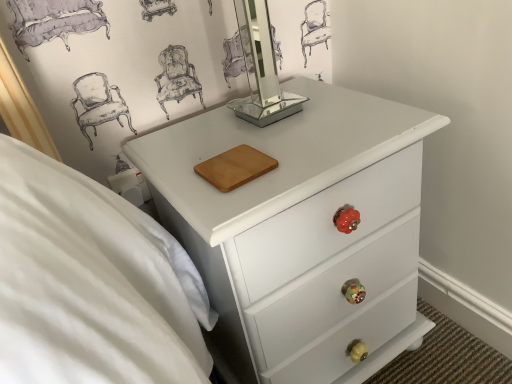
At what (x,y) coordinates should I click in order to perform the action: click on free point above white glossy chest of drawers at center (from a real-world perspective). Please return your answer as a coordinate pair (x, y). This screenshot has height=384, width=512. Looking at the image, I should click on (279, 131).